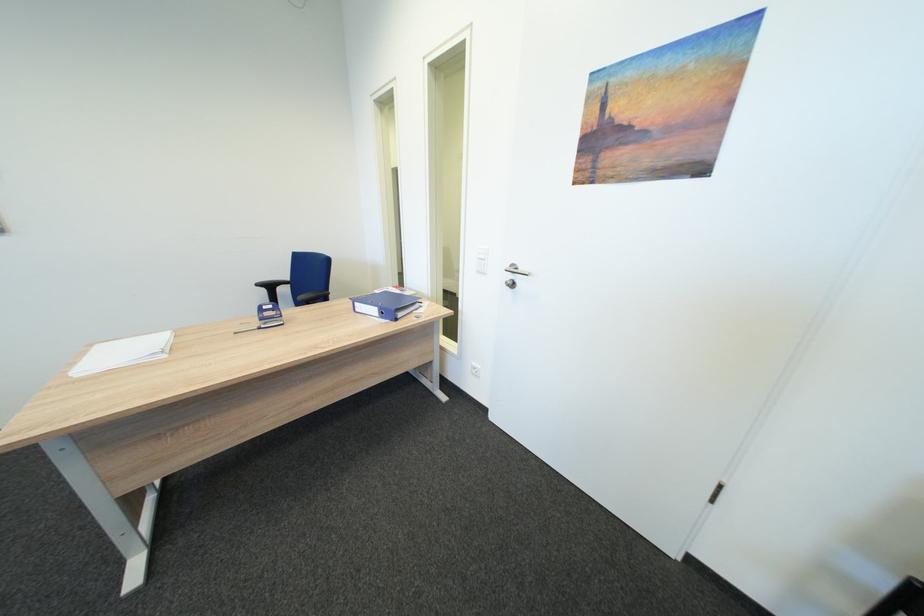
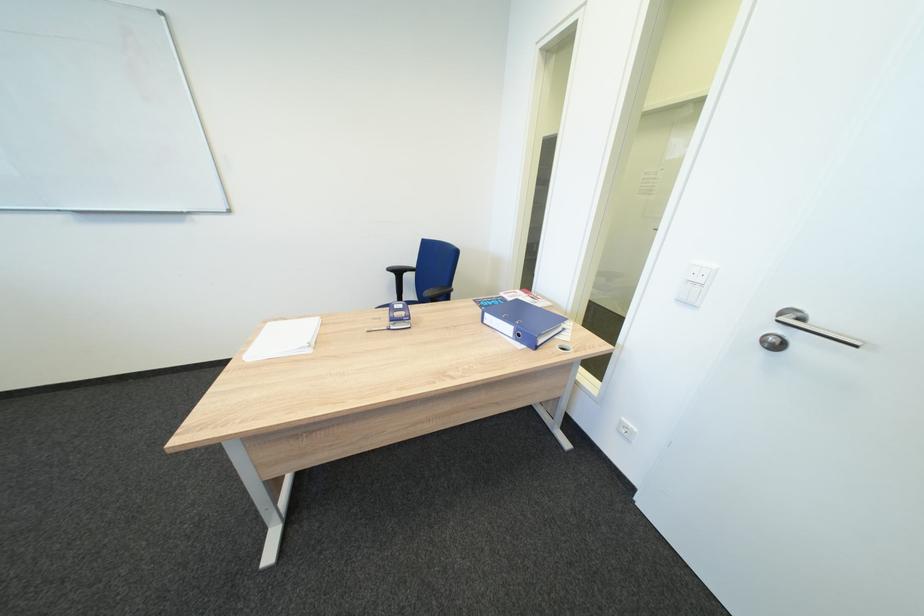
The point at (271, 286) is marked in the first image. Where is the corresponding point in the second image?

(400, 270)